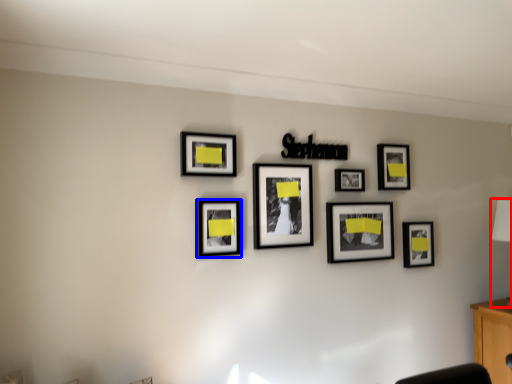
Question: Which of the following is the farthest to the observer, table lamp (highlighted by a red box) or picture frame (highlighted by a blue box)?

Choices:
 (A) table lamp
 (B) picture frame

Answer: (A)